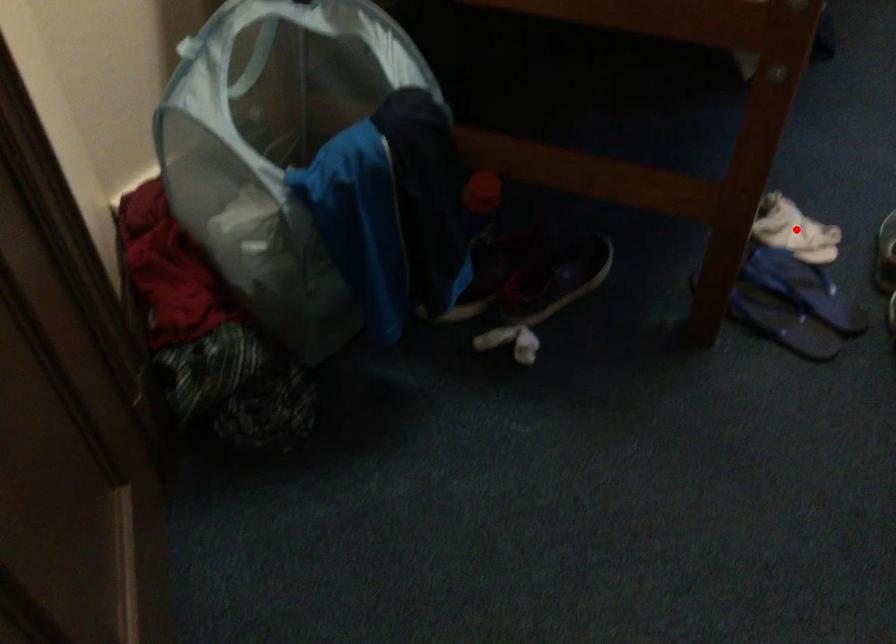
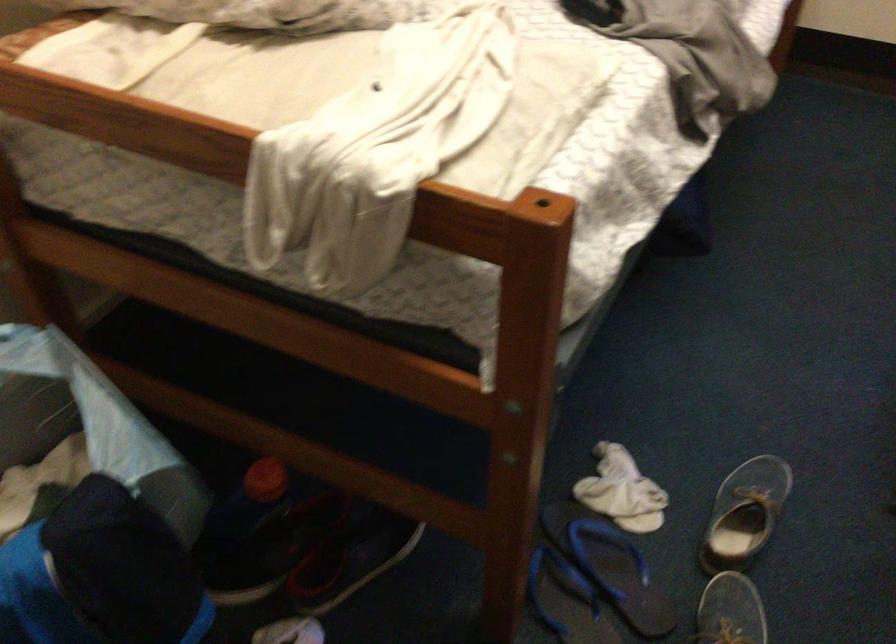
Where in the second image is the point corresponding to the highlighted location from the first image?

(622, 491)